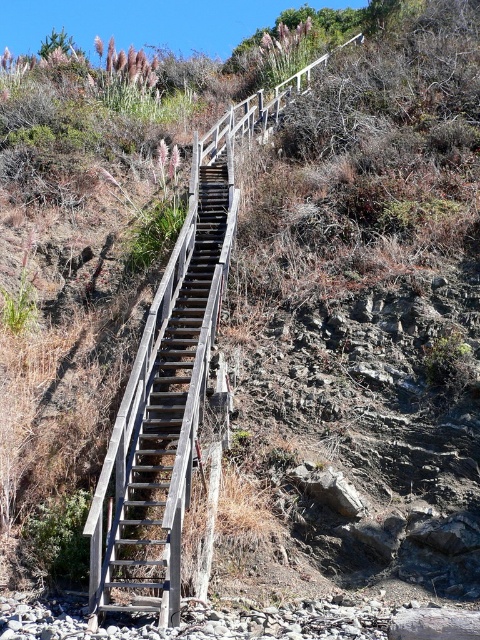
Looking at this image, you are a hiker trying to reach the top of the hill. You see the wooden rail at upper center and the weathered wood stairs at center. Which structure is taller when viewed from below?

The wooden rail at upper center is taller than the weathered wood stairs at center.

You are hiking up a steep hill and need to hold onto something stable. The wooden rail at upper center and the weathered wood stairs at center are both nearby. Which one is positioned to the right side of the stairs?

The wooden rail at upper center is positioned to the right of the weathered wood stairs at center according to the description.

Consider the image. You are a painter who needs to decide which object to paint first between the wooden rail at upper center and the weathered wood stairs at center. Based on their sizes, which one should you choose?

The wooden rail at upper center is bigger than the weathered wood stairs at center, so you should paint the wooden rail at upper center first.